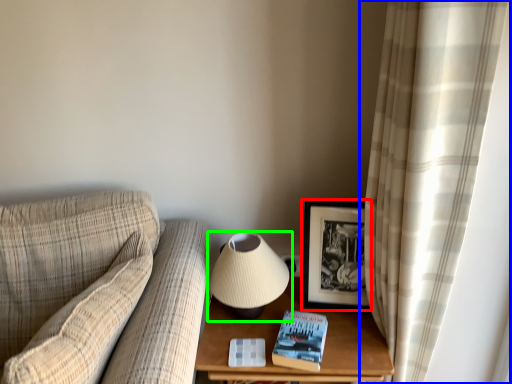
Question: Based on their relative distances, which object is farther from picture frame (highlighted by a red box)? Choose from curtain (highlighted by a blue box) and lamp (highlighted by a green box).

Choices:
 (A) curtain
 (B) lamp

Answer: (A)